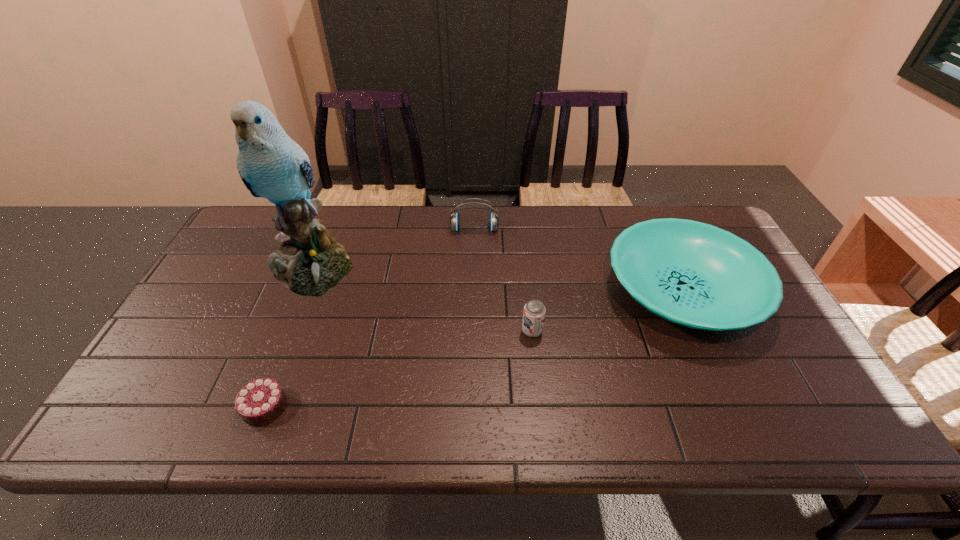
Find the location of a particular element. This screenshot has width=960, height=540. free spot at the left edge of the desktop is located at coordinates (193, 334).

Find the location of a particular element. This screenshot has height=540, width=960. vacant space at the far left corner of the desktop is located at coordinates (239, 232).

The width and height of the screenshot is (960, 540). In order to click on vacant space at the near right corner in this screenshot , I will do `click(811, 414)`.

The image size is (960, 540). In order to click on blank region between the third object from left to right and the fourth object from left to right in this screenshot , I will do `click(503, 280)`.

Find the location of `free space between the beer can and the tallest object`. free space between the beer can and the tallest object is located at coordinates (422, 299).

At what (x,y) coordinates should I click in order to perform the action: click on free space between the second object from right to left and the parakeet. Please return your answer as a coordinate pair (x, y). Image resolution: width=960 pixels, height=540 pixels. Looking at the image, I should click on (422, 299).

This screenshot has width=960, height=540. Identify the location of vacant area that lies between the dish and the nearest object. (473, 349).

The width and height of the screenshot is (960, 540). Identify the location of free space between the headset and the rightmost object. (578, 261).

Where is `free space between the chocolate cake and the headset`? This screenshot has height=540, width=960. free space between the chocolate cake and the headset is located at coordinates (370, 318).

At what (x,y) coordinates should I click in order to perform the action: click on vacant point located between the dish and the farthest object. Please return your answer as a coordinate pair (x, y). Looking at the image, I should click on (578, 261).